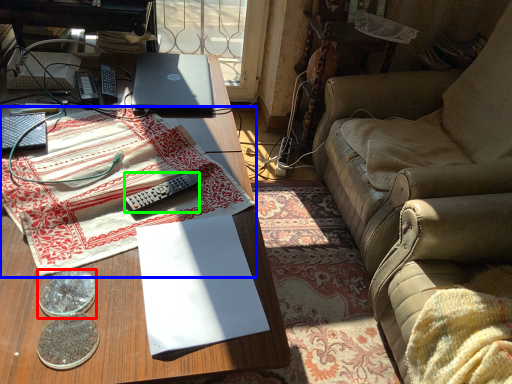
Question: Considering the real-world distances, which object is closest to coin (highlighted by a red box)? tablecloth (highlighted by a blue box) or remote control (highlighted by a green box).

Choices:
 (A) tablecloth
 (B) remote control

Answer: (B)